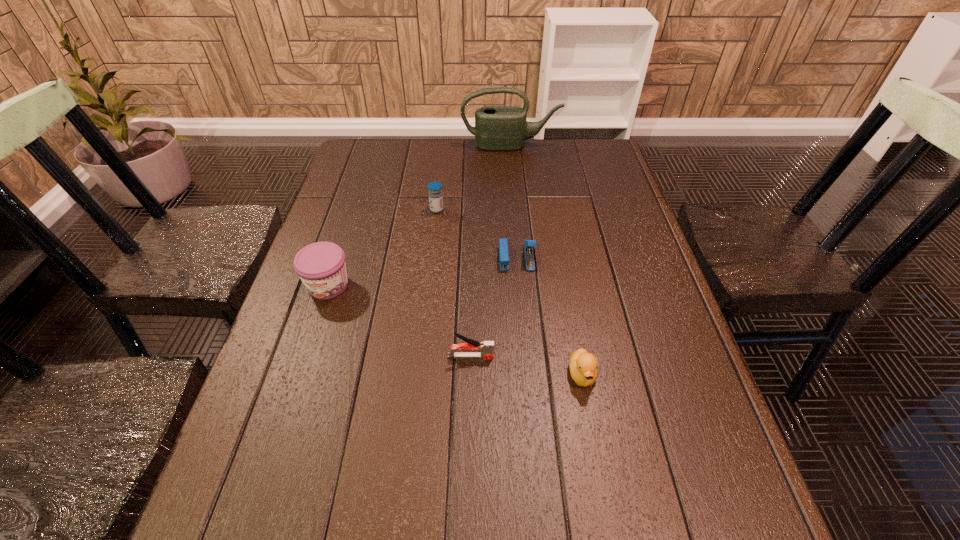
Find the location of a particular element. blank space at the far right corner is located at coordinates (603, 166).

Identify the location of vacant space at the near right corner of the desktop. (733, 538).

Find the location of a particular element. The height and width of the screenshot is (540, 960). vacant area that lies between the nearer stapler and the fifth nearest object is located at coordinates (454, 283).

This screenshot has width=960, height=540. In order to click on vacant area that lies between the farthest object and the jam in this screenshot , I will do `click(420, 215)`.

The image size is (960, 540). What are the coordinates of `free space that is in between the tallest object and the right stapler` in the screenshot? It's located at (514, 202).

Locate an element on the screen. The height and width of the screenshot is (540, 960). blank region between the left stapler and the leftmost object is located at coordinates (399, 321).

The width and height of the screenshot is (960, 540). I want to click on free spot between the duckling and the jam, so coord(455,330).

Identify the location of free point between the fifth nearest object and the duckling. (510, 292).

The height and width of the screenshot is (540, 960). I want to click on free spot between the duckling and the left stapler, so click(526, 366).

Identify the location of free space between the duckling and the fifth object from right to left. The image size is (960, 540). (510, 292).